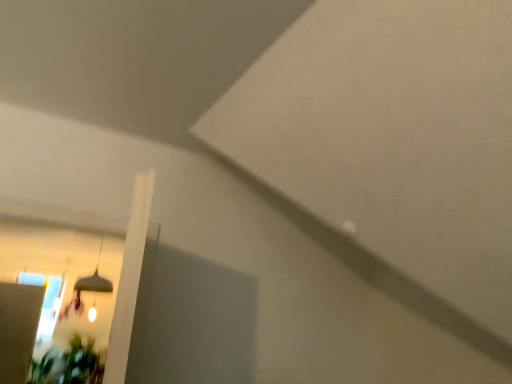
Identify the location of matte gray lampshade at upper left. (92, 288).

What do you see at coordinates (92, 288) in the screenshot?
I see `matte gray lampshade at upper left` at bounding box center [92, 288].

The image size is (512, 384). In order to click on matte gray lampshade at upper left in this screenshot , I will do `click(92, 288)`.